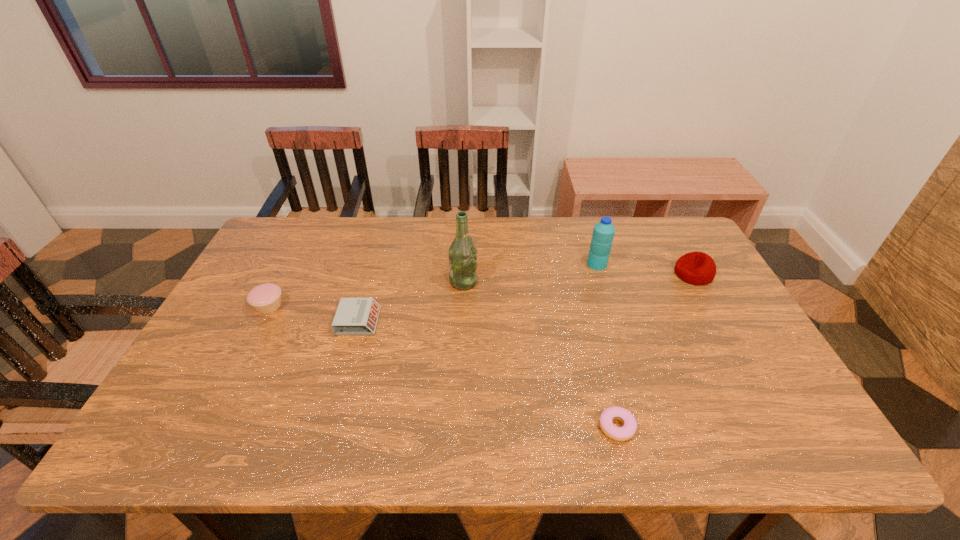
The width and height of the screenshot is (960, 540). What are the coordinates of `the shortest object` in the screenshot? It's located at (627, 431).

This screenshot has height=540, width=960. Identify the location of free space located on the surface of the fourth object from right to left. (601, 282).

This screenshot has width=960, height=540. Find the location of `blank space located 0.060m on the front of the water bottle`. blank space located 0.060m on the front of the water bottle is located at coordinates (603, 283).

Find the location of a particular element. This screenshot has width=960, height=540. blank space located 0.310m on the seat area of the beanbag is located at coordinates 576,274.

Find the location of a particular element. The width and height of the screenshot is (960, 540). vacant space located 0.170m on the seat area of the beanbag is located at coordinates (620, 274).

This screenshot has height=540, width=960. I want to click on free space located on the seat area of the beanbag, so click(554, 274).

Find the location of a particular element. The width and height of the screenshot is (960, 540). vacant point located 0.390m on the back of the fourth tallest object is located at coordinates [312, 221].

Identify the location of free location located 0.210m on the front of the alarm clock. (335, 403).

Find the location of `vacant space situated 0.100m on the right of the nearest object`. vacant space situated 0.100m on the right of the nearest object is located at coordinates (680, 427).

Identify the location of object that is positioned at the far edge. (603, 233).